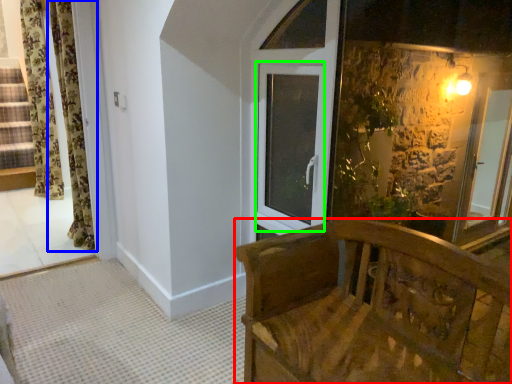
Question: Which is nearer to the furniture (highlighted by a red box)? curtain (highlighted by a blue box) or window (highlighted by a green box).

Choices:
 (A) curtain
 (B) window

Answer: (B)